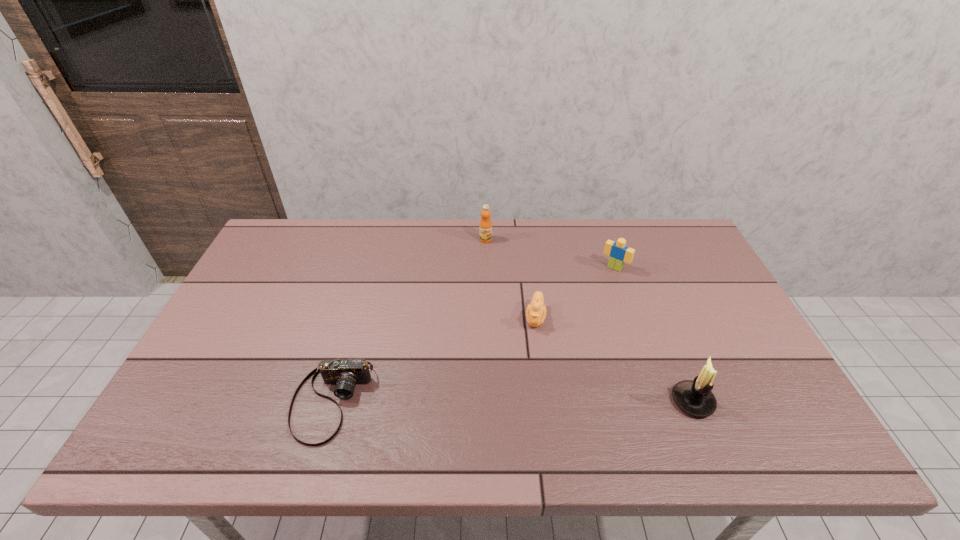
Identify the location of unoccupied position between the orange juice and the candle holder. (589, 320).

Find the location of a particular element. This screenshot has height=540, width=960. free space between the candle holder and the Lego is located at coordinates (654, 335).

You are a GUI agent. You are given a task and a screenshot of the screen. Output one action in this format:
    pyautogui.click(x=<x>, y=<y>)
    Task: Click on the vacant point located between the second farthest object and the candle holder
    The height and width of the screenshot is (540, 960).
    Given the screenshot: What is the action you would take?
    pyautogui.click(x=654, y=335)

Locate an element on the screen. The image size is (960, 540). vacant area that lies between the candle holder and the second farthest object is located at coordinates (654, 335).

Find the location of a particular element. The width and height of the screenshot is (960, 540). unoccupied position between the third object from left to right and the candle holder is located at coordinates coord(613,359).

Where is `blank region between the Lego and the fourth object from right to left`? Image resolution: width=960 pixels, height=540 pixels. blank region between the Lego and the fourth object from right to left is located at coordinates (550, 254).

Where is `free area in between the leftmost object and the third farthest object`? The image size is (960, 540). free area in between the leftmost object and the third farthest object is located at coordinates (433, 359).

What are the coordinates of `empty space that is in between the leftmost object and the Lego` in the screenshot? It's located at (473, 335).

Locate which object ranks fourth in proximity to the fourth nearest object. Please provide its 2D coordinates. Your answer should be formatted as a tuple, i.e. [(x, y)], where the tuple contains the x and y coordinates of a point satisfying the conditions above.

[(345, 374)]

The image size is (960, 540). Identify the location of object that is the fourth closest to the Lego. (345, 374).